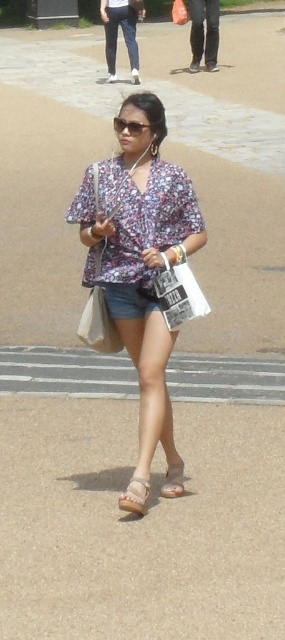
You are a delivery robot with a 1.2 meter wide package. You need to pass through the space between the white paper bag at center and the light beige suede sandal at lower center. Can you fit through?

The distance between the white paper bag at center and the light beige suede sandal at lower center is 1.17 meters. Since the package is 1.2 meters wide, it is slightly wider than the available space. The robot cannot fit through the gap between them.

Based on the scene description, can you determine if the smooth concrete sidewalk at center is wider than the denim shorts at center?

The smooth concrete sidewalk at center has a larger size compared to denim shorts at center, so yes, the sidewalk is wider than the denim shorts.